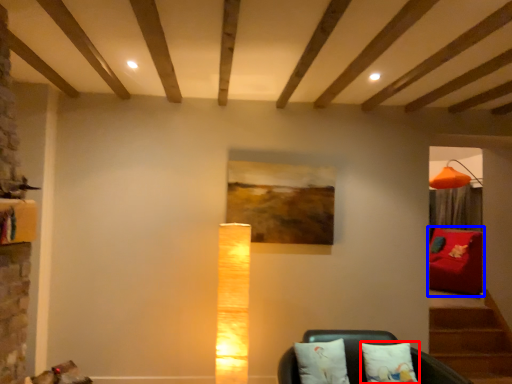
Question: Among these objects, which one is farthest to the camera, pillow (highlighted by a red box) or furniture (highlighted by a blue box)?

Choices:
 (A) pillow
 (B) furniture

Answer: (B)